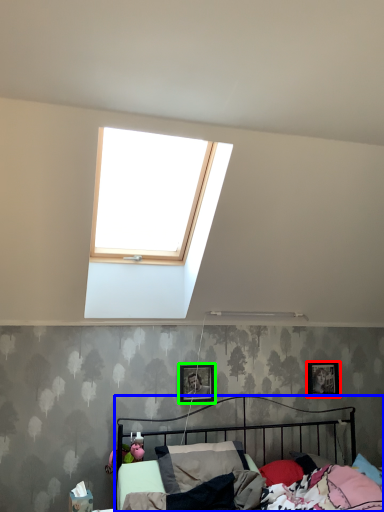
Question: Which object is the closest to the picture frame (highlighted by a red box)? Choose among these: bed (highlighted by a blue box) or picture frame (highlighted by a green box).

Choices:
 (A) bed
 (B) picture frame

Answer: (A)